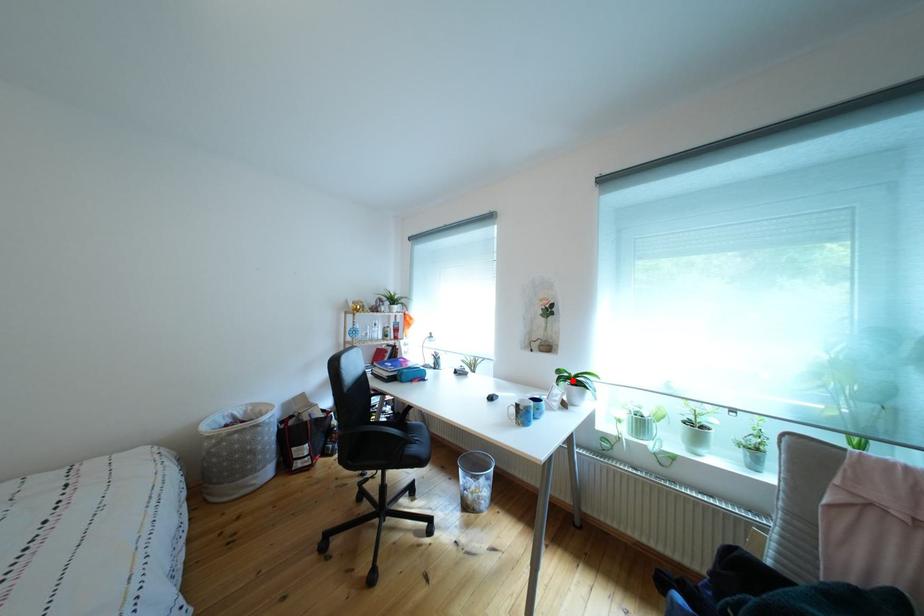
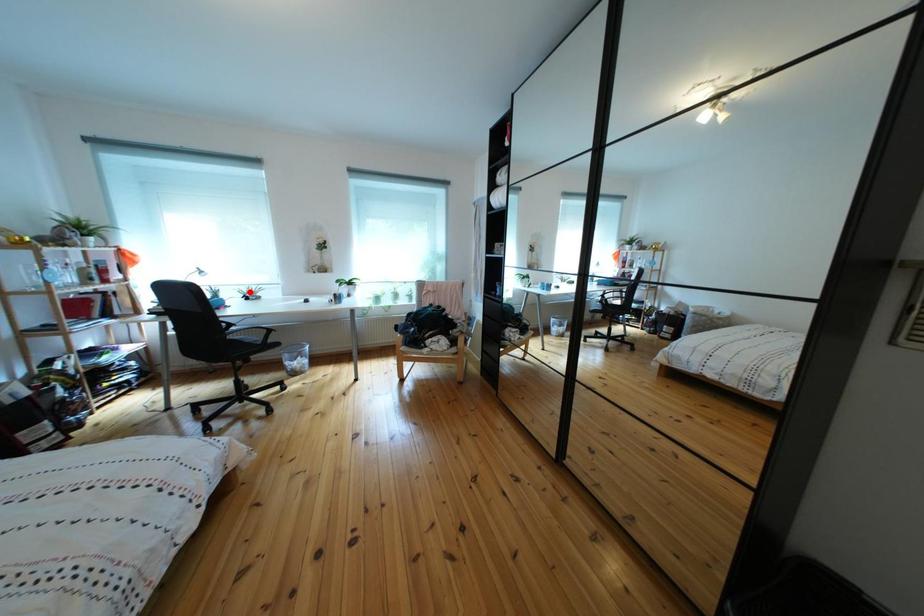
I am providing you with two images of the same scene from different viewpoints. A red point is marked on the first image and another point is marked on the second image. Are the points marked in image1 and image2 representing the same 3D position?

No